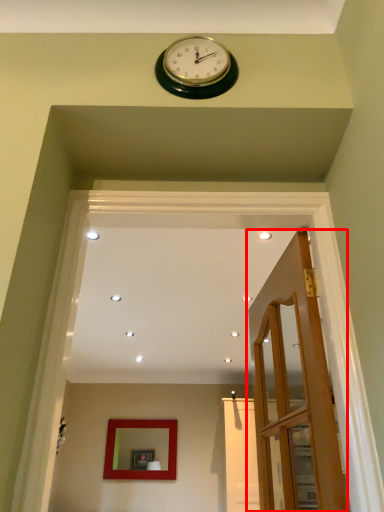
Question: From the image's perspective, where is door (annotated by the red box) located in relation to mirror in the image?

Choices:
 (A) below
 (B) above

Answer: (B)